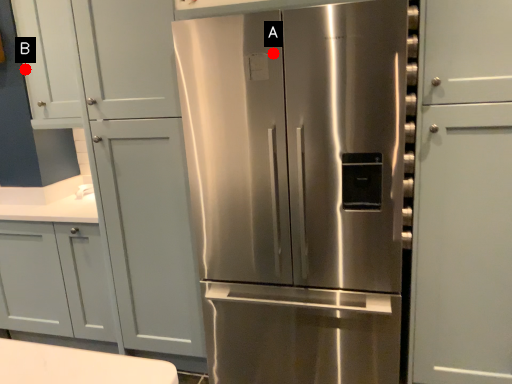
Question: Two points are circled on the image, labeled by A and B beside each circle. Which of the following is the closest to the observer?

Choices:
 (A) A is closer
 (B) B is closer

Answer: (A)